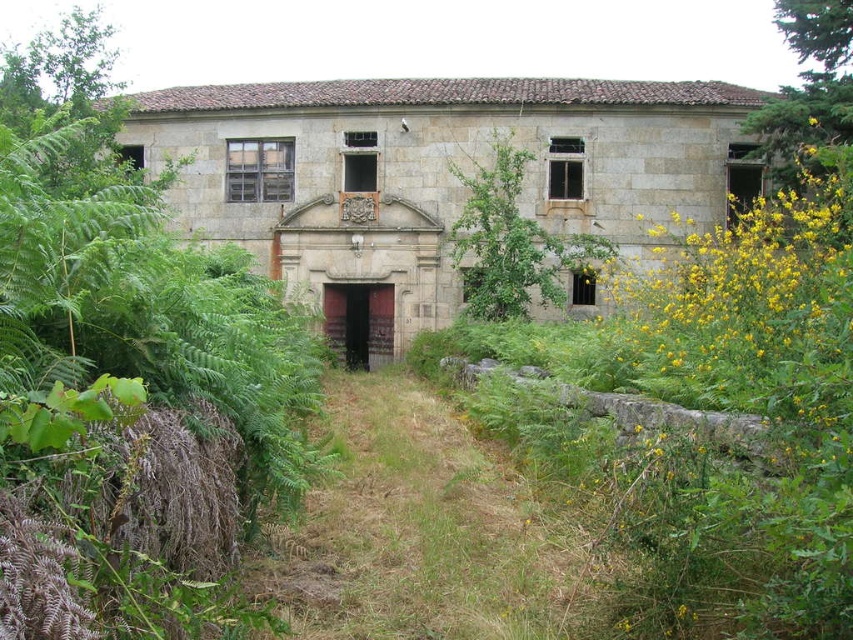
Based on the photo, who is higher up, green leafy shrubs at center or green leafy plant at left?

green leafy plant at left is higher up.

Locate an element on the screen. This screenshot has width=853, height=640. green leafy shrubs at center is located at coordinates (701, 419).

Where is `green leafy shrubs at center`? green leafy shrubs at center is located at coordinates (701, 419).

Is green leafy shrubs at center positioned behind green grass at center?

No, it is not.

Measure the distance between green leafy shrubs at center and green grass at center.

green leafy shrubs at center is 10.36 meters away from green grass at center.

Where is `green leafy shrubs at center`? This screenshot has height=640, width=853. green leafy shrubs at center is located at coordinates (701, 419).

Describe the element at coordinates (132, 410) in the screenshot. I see `green leafy plant at left` at that location.

Can you confirm if green leafy plant at left is positioned above green leafy shrub at center?

Actually, green leafy plant at left is below green leafy shrub at center.

In order to click on green leafy plant at left in this screenshot , I will do `click(132, 410)`.

I want to click on green leafy plant at left, so (x=132, y=410).